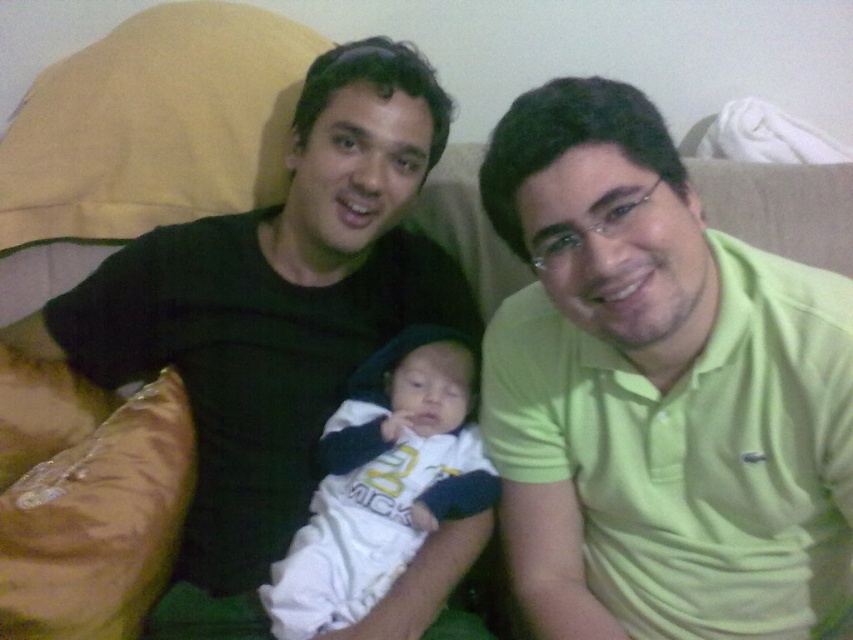
Question: Is light green polo shirt at center below brown leather pillow at lower left?

Choices:
 (A) yes
 (B) no

Answer: (B)

Question: Can you confirm if light green polo shirt at center is positioned to the left of brown leather pillow at lower left?

Choices:
 (A) yes
 (B) no

Answer: (B)

Question: Which point is farther to the camera?

Choices:
 (A) light green polo shirt at center
 (B) black matte shirt at center
 (C) brown leather pillow at lower left

Answer: (B)

Question: Which point appears closest to the camera in this image?

Choices:
 (A) (178, 440)
 (B) (782, 620)
 (C) (451, 113)

Answer: (B)

Question: Which of these objects is positioned closest to the light green polo shirt at center?

Choices:
 (A) white soft fabric baby at center
 (B) black matte shirt at center

Answer: (A)

Question: Can you confirm if white soft fabric baby at center is bigger than brown leather pillow at lower left?

Choices:
 (A) yes
 (B) no

Answer: (A)